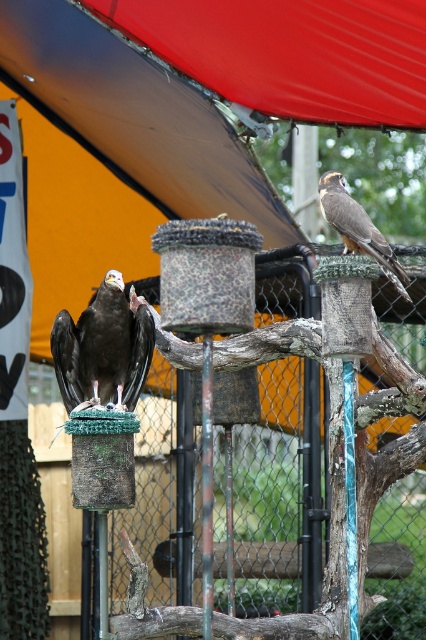
Which is below, dark brown feathers at center or brown feathered eagle at upper right?

dark brown feathers at center is lower down.

Does dark brown feathers at center come in front of brown feathered eagle at upper right?

No, it is behind brown feathered eagle at upper right.

Which is in front, point (66, 352) or point (394, 284)?

Point (394, 284) is in front.

Identify the location of dark brown feathers at center. This screenshot has height=640, width=426. (103, 349).